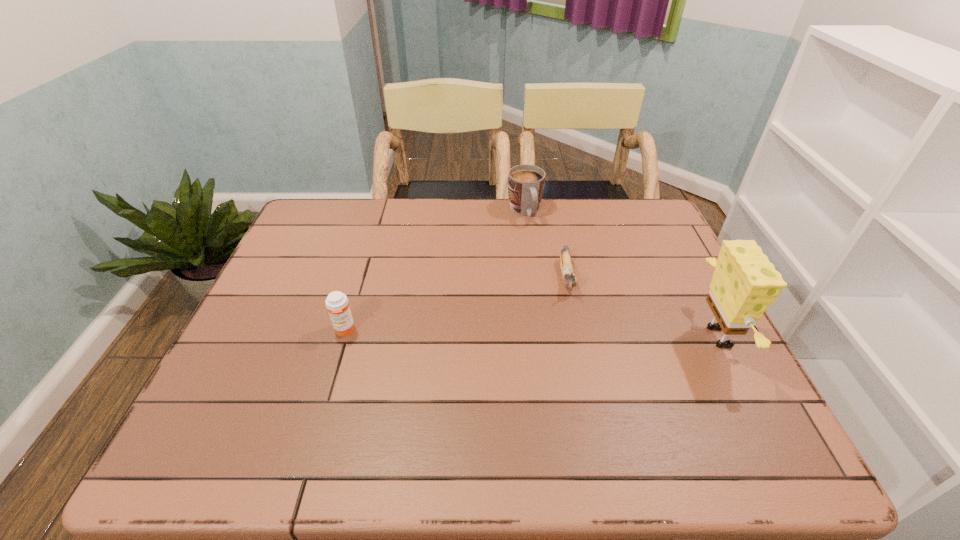
Where is `vacant space on the desktop that is between the leftmost object and the sponge and is positioned on the side of the mug with the handle`? The image size is (960, 540). vacant space on the desktop that is between the leftmost object and the sponge and is positioned on the side of the mug with the handle is located at coordinates (582, 334).

Find the location of a particular element. free space on the desktop that is between the medicine and the rightmost object and is positioned on the peel of the shortest object is located at coordinates (576, 334).